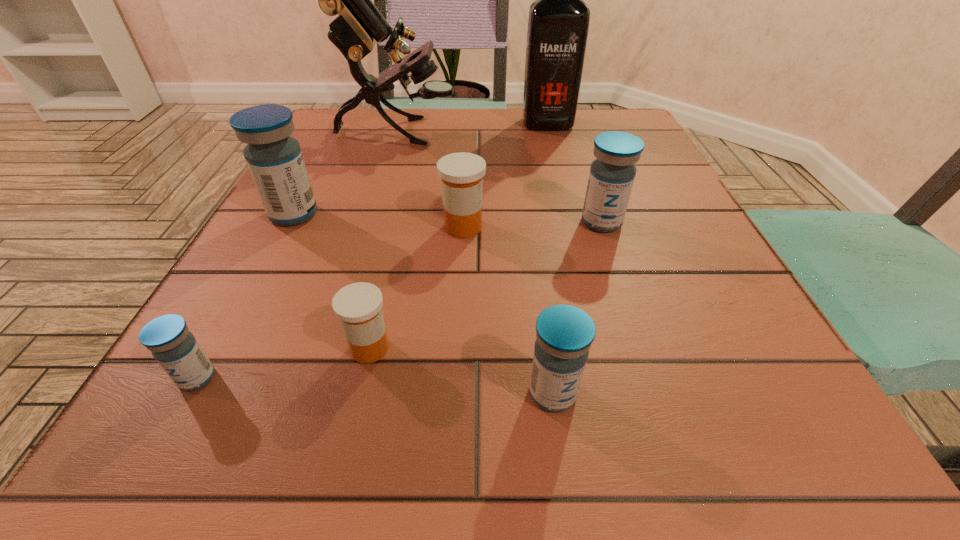
Where is `blank region between the rightmost blue medicine and the third medicine from left to right`? This screenshot has height=540, width=960. blank region between the rightmost blue medicine and the third medicine from left to right is located at coordinates (486, 285).

Find the location of a particular element. The image size is (960, 540). empty location between the sixth shortest object and the farther orange medicine is located at coordinates (378, 221).

The image size is (960, 540). I want to click on vacant region between the smaller orange medicine and the biggest blue medicine, so click(332, 281).

Image resolution: width=960 pixels, height=540 pixels. I want to click on empty location between the fourth tallest object and the left orange medicine, so click(x=486, y=285).

Where is `vacant space that's between the second medicine from right to left and the rightmost blue medicine`? This screenshot has width=960, height=540. vacant space that's between the second medicine from right to left and the rightmost blue medicine is located at coordinates [577, 308].

Where is `the third closest object to the sixth shortest object`? the third closest object to the sixth shortest object is located at coordinates (359, 305).

Image resolution: width=960 pixels, height=540 pixels. I want to click on the fifth closest object to the third tallest object, so click(x=564, y=334).

You are a GUI agent. You are given a task and a screenshot of the screen. Output one action in this format:
    pyautogui.click(x=<x>, y=<y>)
    Task: Click on the medicine identified as the second closest to the smallest blue medicine
    
    Given the screenshot: What is the action you would take?
    pyautogui.click(x=274, y=158)

Select which medicine appears as the third closest to the black liquor. Please provide its 2D coordinates. Your answer should be formatted as a tuple, i.e. [(x, y)], where the tuple contains the x and y coordinates of a point satisfying the conditions above.

[(274, 158)]

At what (x,y) coordinates should I click in order to perform the action: click on blue medicine identified as the second closest to the farther orange medicine. Please return your answer as a coordinate pair (x, y). The image size is (960, 540). Looking at the image, I should click on (274, 158).